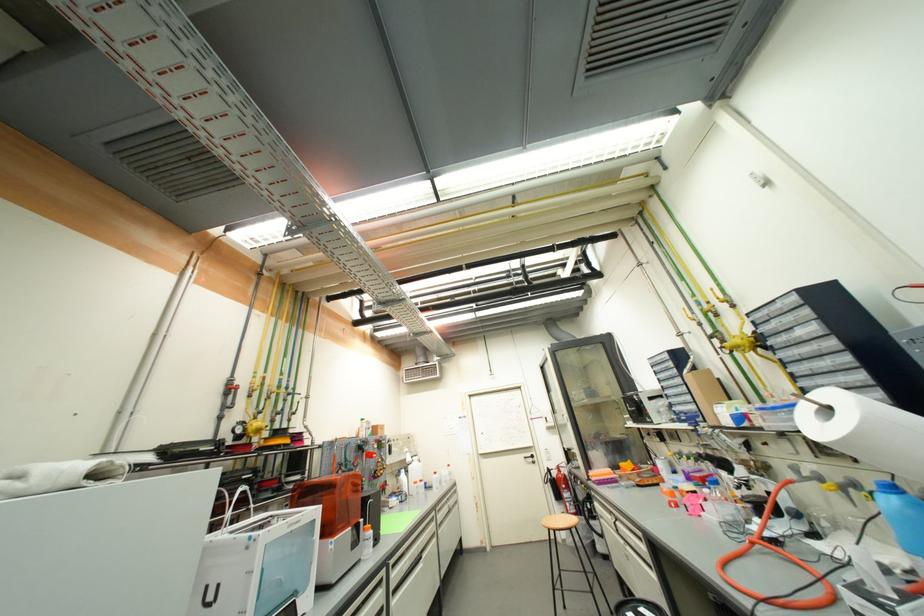
At what (x,y) coordinates should I click in order to perform the action: click on chair sitting surface. Please return your answer as a coordinate pair (x, y). The image size is (924, 616). Looking at the image, I should click on [570, 562].